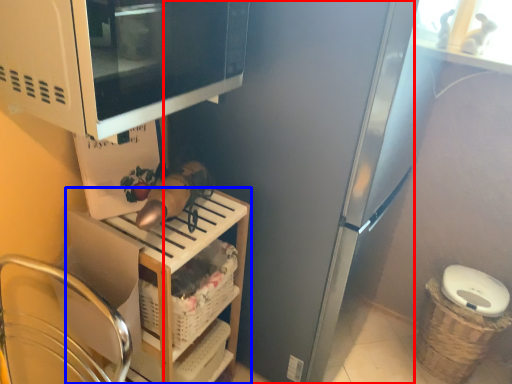
Question: Which point is further to the camera, appliance (highlighted by a red box) or shelf (highlighted by a blue box)?

Choices:
 (A) appliance
 (B) shelf

Answer: (B)